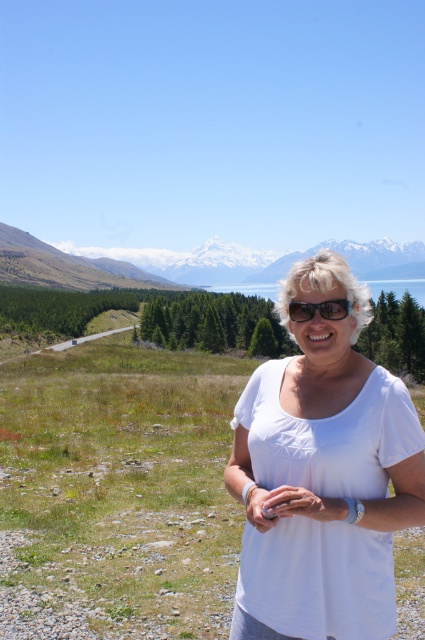
Which is more to the right, snowy granite mountain at upper left or clear blue water at center?

→ clear blue water at center

In the scene shown: Can you confirm if snowy granite mountain at upper left is shorter than clear blue water at center?

Incorrect, snowy granite mountain at upper left's height does not fall short of clear blue water at center's.

Which is in front, point (47, 252) or point (240, 289)?

Point (47, 252) is more forward.

You are a GUI agent. You are given a task and a screenshot of the screen. Output one action in this format:
    pyautogui.click(x=<x>, y=<y>)
    Task: Click on the snowy granite mountain at upper left
    The image size is (425, 640).
    Given the screenshot: What is the action you would take?
    [x=67, y=266]

Is white cotton shirt at center further to camera compared to black plastic sunglasses at center?

No, white cotton shirt at center is in front of black plastic sunglasses at center.

Is white cotton shirt at center below black plastic sunglasses at center?

Indeed, white cotton shirt at center is positioned under black plastic sunglasses at center.

Between point (365, 484) and point (325, 304), which one is positioned in front?

Point (365, 484) is in front.

This screenshot has width=425, height=640. Find the location of `white cotton shirt at center`. white cotton shirt at center is located at coordinates (323, 474).

Is snowy granite mountain at upper left above black plastic sunglasses at center?

Indeed, snowy granite mountain at upper left is positioned over black plastic sunglasses at center.

Who is positioned more to the left, snowy granite mountain at upper left or black plastic sunglasses at center?

snowy granite mountain at upper left

Which is behind, point (153, 285) or point (289, 314)?

Positioned behind is point (153, 285).

Image resolution: width=425 pixels, height=640 pixels. What are the coordinates of `snowy granite mountain at upper left` in the screenshot? It's located at (67, 266).